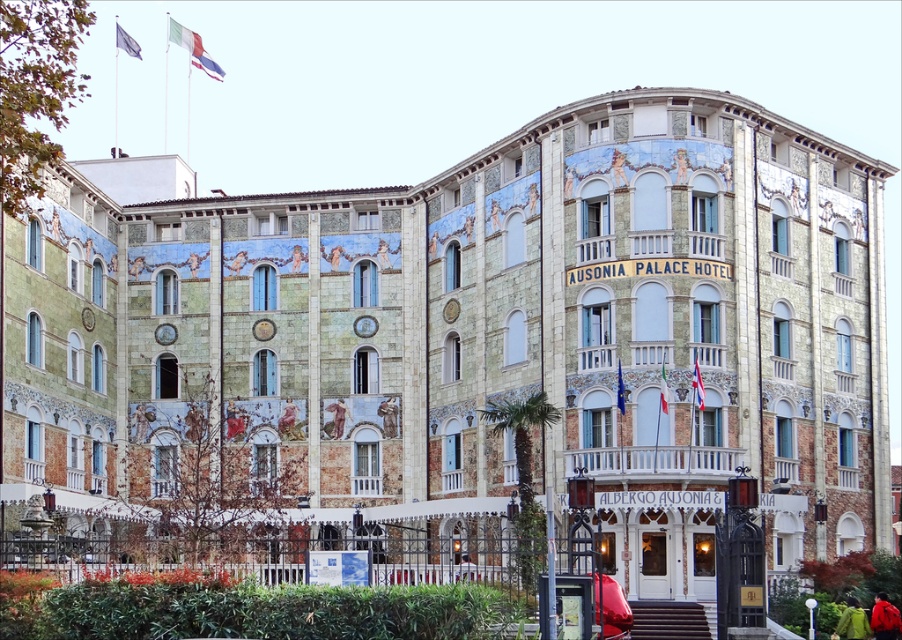
The image size is (902, 640). In order to click on red jacket at center in this screenshot , I will do `click(884, 618)`.

Where is `red jacket at center`? The height and width of the screenshot is (640, 902). red jacket at center is located at coordinates (884, 618).

Where is `red jacket at center`? Image resolution: width=902 pixels, height=640 pixels. red jacket at center is located at coordinates (884, 618).

Between red jacket at center and brown textured fabric at center, which one is positioned higher?

brown textured fabric at center

What do you see at coordinates (884, 618) in the screenshot? I see `red jacket at center` at bounding box center [884, 618].

Locate an element on the screen. This screenshot has width=902, height=640. red jacket at center is located at coordinates (884, 618).

Is green matte jacket at lower right shorter than brown textured fabric at center?

Indeed, green matte jacket at lower right has a lesser height compared to brown textured fabric at center.

Does point (852, 600) come behind point (339, 417)?

That is False.

I want to click on green matte jacket at lower right, so click(852, 621).